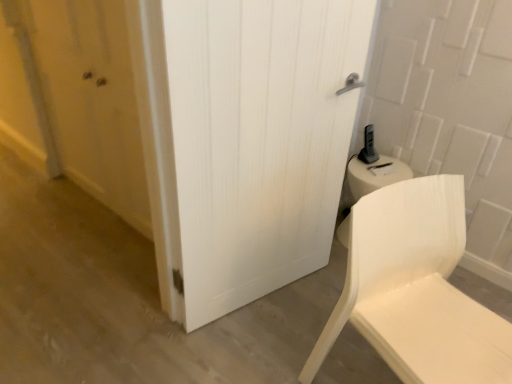
Question: Considering the positions of point (389, 334) and point (87, 29), is point (389, 334) closer or farther from the camera than point (87, 29)?

Choices:
 (A) closer
 (B) farther

Answer: (A)

Question: Considering the positions of white matte chair at lower right and matte wooden door at left in the image, is white matte chair at lower right wider or thinner than matte wooden door at left?

Choices:
 (A) wide
 (B) thin

Answer: (A)

Question: Based on their relative distances, which object is nearer to the matte wooden door at left?

Choices:
 (A) white matte chair at lower right
 (B) white wood door at center

Answer: (B)

Question: Considering the real-world distances, which object is farthest from the white wood door at center?

Choices:
 (A) matte wooden door at left
 (B) white matte chair at lower right

Answer: (A)